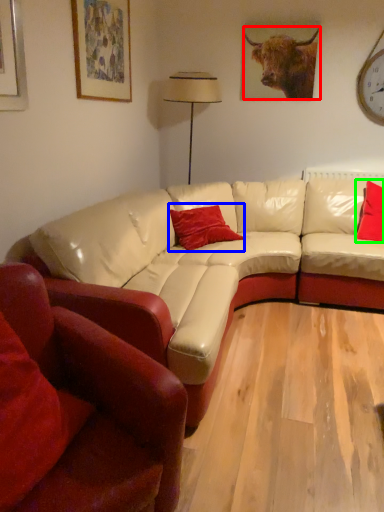
Question: Which object is positioned closest to bull (highlighted by a red box)? Select from pillow (highlighted by a blue box) and pillow (highlighted by a green box).

Choices:
 (A) pillow
 (B) pillow

Answer: (B)